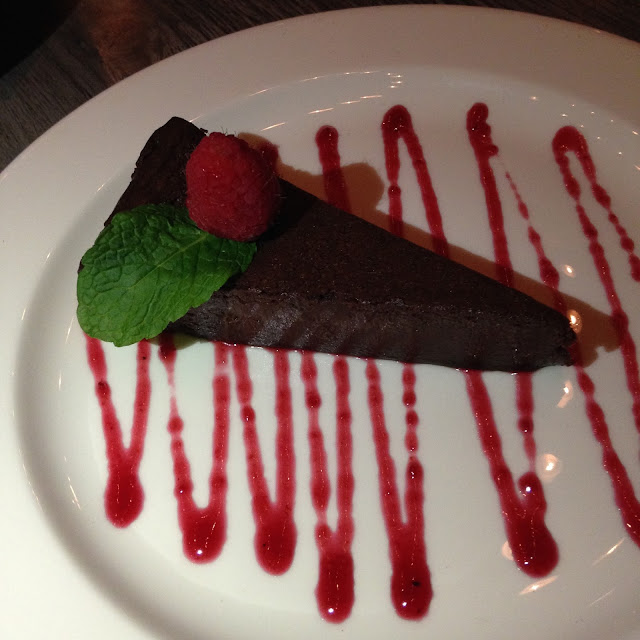
Find the location of `plate`. plate is located at coordinates (470, 58).